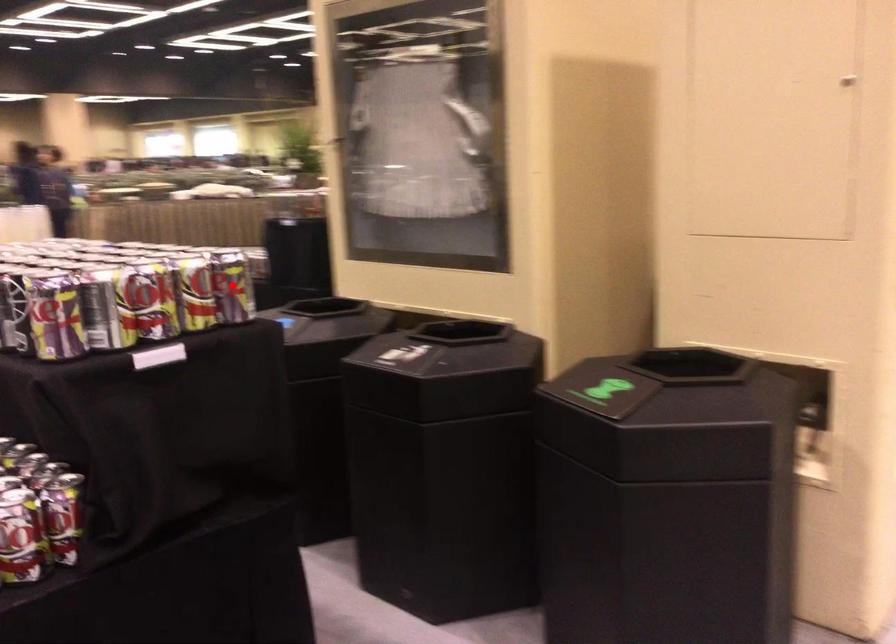
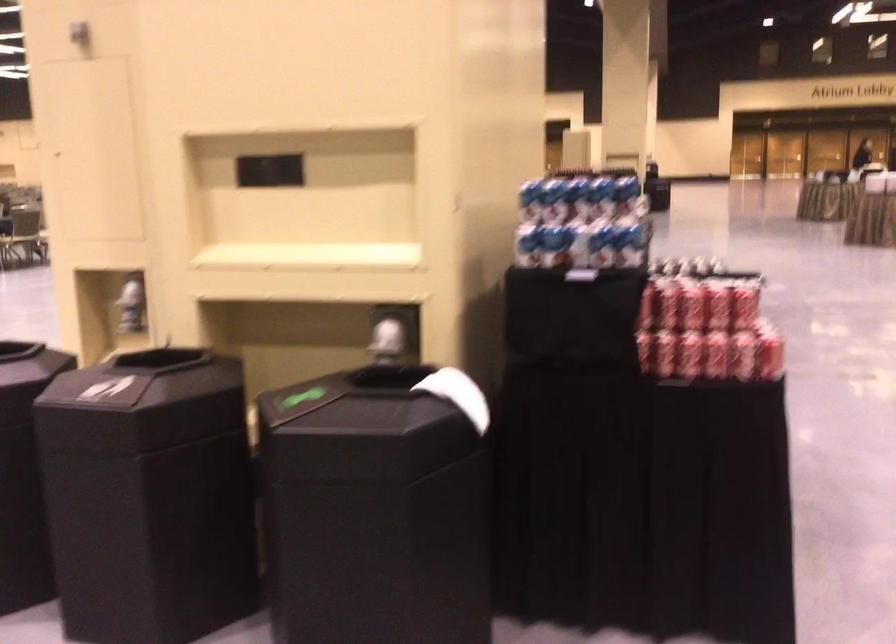
Question: I am providing you with two images of the same scene from different viewpoints. A red point is marked on the first image. Can you still see the location of the red point in image 2?

Choices:
 (A) Yes
 (B) No

Answer: (B)